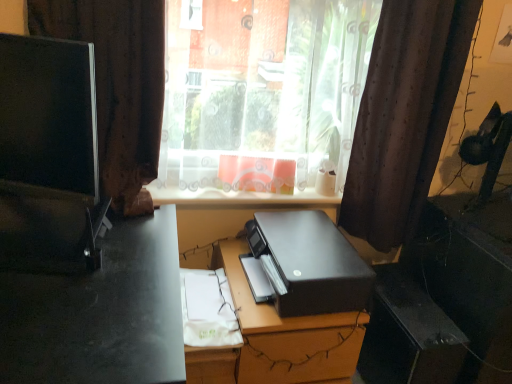
Question: Is black matte printer at center bigger or smaller than transparent plastic window at center?

Choices:
 (A) big
 (B) small

Answer: (A)

Question: Is point (352, 352) closer or farther from the camera than point (309, 84)?

Choices:
 (A) closer
 (B) farther

Answer: (A)

Question: Which object is the farthest from the black plastic file cabinet at center?

Choices:
 (A) matte black desk at left
 (B) matte black monitor at left
 (C) black matte printer at center
 (D) brown fabric curtain at left, the second curtain positioned from the right
 (E) transparent plastic window at center

Answer: (B)

Question: Which of these objects is positioned closest to the black matte printer at center?

Choices:
 (A) matte black desk at left
 (B) matte black monitor at left
 (C) brown fabric curtain at left, the second curtain positioned from the right
 (D) black matte printer at center
 (E) black plastic file cabinet at center

Answer: (D)